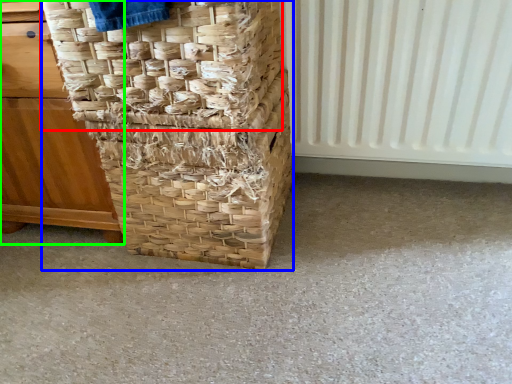
Question: Based on their relative distances, which object is farther from basket (highlighted by a red box)? Choose from basket (highlighted by a blue box) and furniture (highlighted by a green box).

Choices:
 (A) basket
 (B) furniture

Answer: (B)